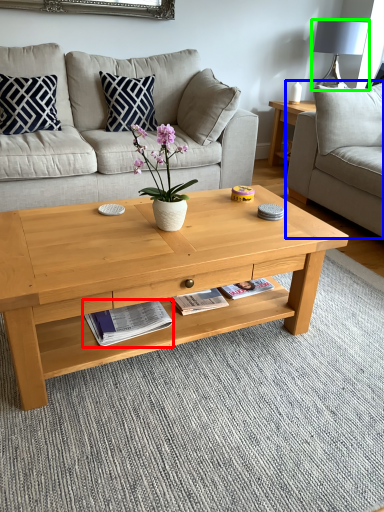
Question: Which object is positioned closest to magazine (highlighted by a red box)? Select from studio couch (highlighted by a blue box) and lamp (highlighted by a green box).

Choices:
 (A) studio couch
 (B) lamp

Answer: (A)